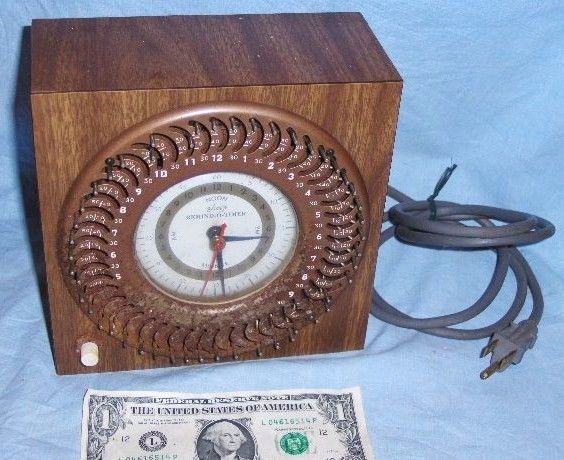
The width and height of the screenshot is (564, 460). In order to click on electrical cord in this screenshot , I will do `click(483, 298)`.